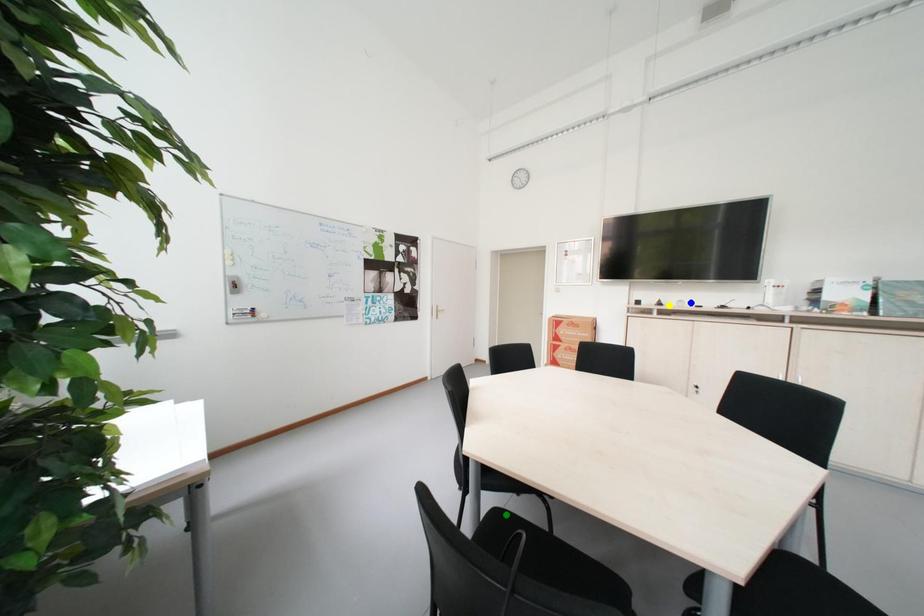
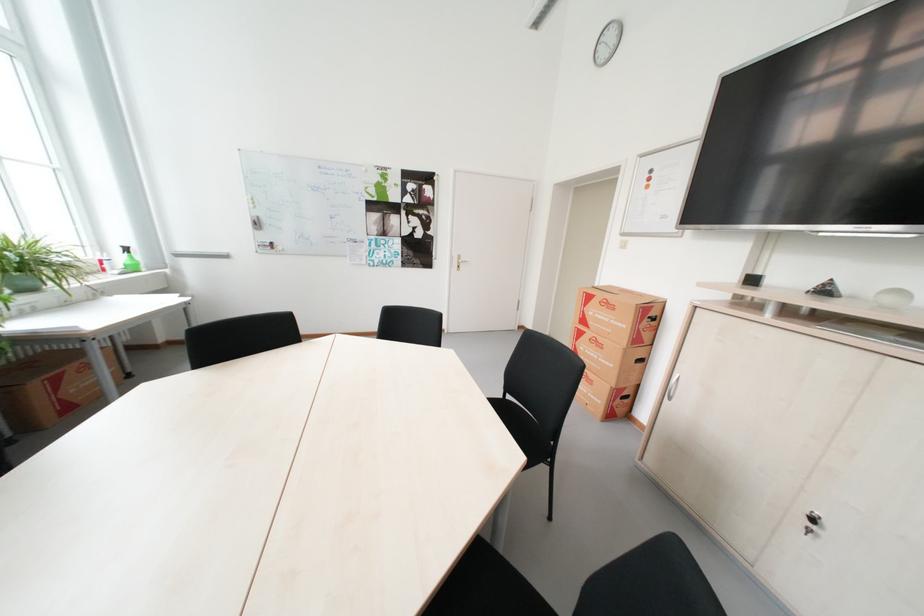
I am providing you with two images of the same scene from different viewpoints. Three points are marked in image1. Which point corresponds to a part or object that is occluded in image2?In image1, three points are marked. Which of them correspond to a part or object that is occluded in image2?Among the three points shown in image1, which one corresponds to a part or object that is no longer visible due to occlusion in image2?

green point cannot be seen in image2.